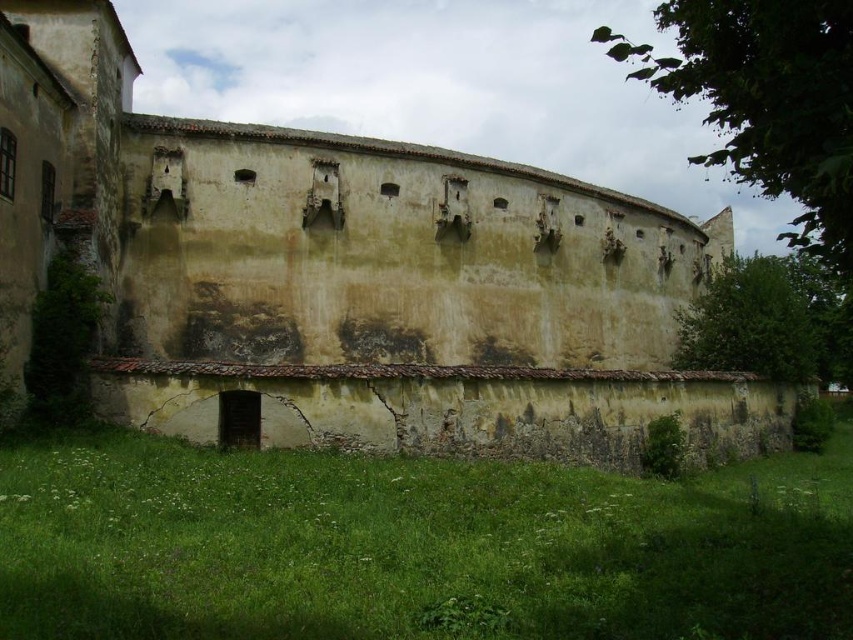
Consider the image. You are standing in front of the aged stone wall and want to determine the relative positions of two points marked on the wall. Which point is closer to you, point (206, 380) or point (596, 604)?

Point (596, 604) is closer to you because point (206, 380) is behind it.

You are an architect examining the historical site. You notice the weathered stone wall at center and the green grass at lower center. Which object occupies a greater area in the image?

The weathered stone wall at center is larger in size than the green grass at lower center, so it occupies a greater area in the image.

You are standing in front of a historical structure with a large stone wall. There is a point marked at coordinates (347, 276). What does this point indicate on the weathered stone wall at center?

The point at coordinates (347, 276) marks the weathered stone wall at center.